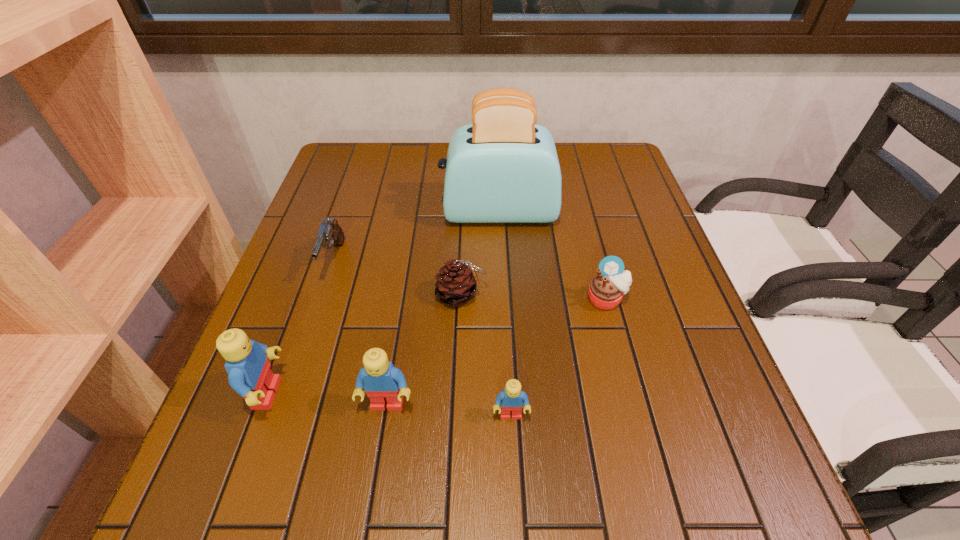
You are a GUI agent. You are given a task and a screenshot of the screen. Output one action in this format:
    pyautogui.click(x=<x>, y=<y>)
    Task: Click on the vacant area situated 0.350m on the side of the farthest object with the lever
    
    Given the screenshot: What is the action you would take?
    pyautogui.click(x=310, y=212)

This screenshot has height=540, width=960. I want to click on vacant space located 0.300m on the side of the farthest object with the lever, so click(328, 212).

This screenshot has width=960, height=540. What are the coordinates of `vacant space located on the side of the farthest object with the lever` in the screenshot? It's located at (332, 212).

Identify the location of vacant space located with a leaf charm attached to the pinecone. (510, 294).

I want to click on vacant space situated 0.270m on the front-facing side of the rightmost object, so click(x=642, y=437).

At what (x,y) coordinates should I click in order to perform the action: click on free location located 0.220m at the barrel of the pistol. Please return your answer as a coordinate pair (x, y). This screenshot has width=960, height=540. Looking at the image, I should click on (297, 372).

I want to click on Lego that is at the left edge, so click(249, 374).

The height and width of the screenshot is (540, 960). Identify the location of pistol that is at the left edge. (330, 234).

The width and height of the screenshot is (960, 540). In order to click on object that is at the right edge in this screenshot , I will do `click(606, 290)`.

You are a GUI agent. You are given a task and a screenshot of the screen. Output one action in this format:
    pyautogui.click(x=<x>, y=<y>)
    Task: Click on the object located at the near left corner
    The image size is (960, 540).
    Given the screenshot: What is the action you would take?
    pyautogui.click(x=249, y=374)